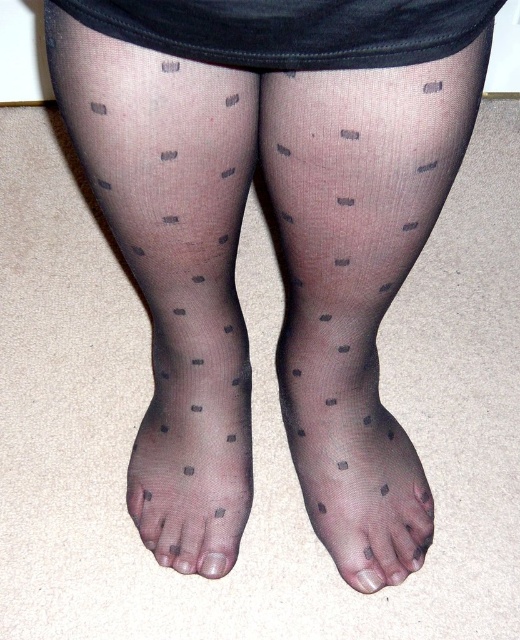
Is transparent sheer tights at center thinner than transparent sheer tights at lower left?

In fact, transparent sheer tights at center might be wider than transparent sheer tights at lower left.

Does transparent sheer tights at center appear under transparent sheer tights at lower left?

Correct, transparent sheer tights at center is located below transparent sheer tights at lower left.

You are a GUI agent. You are given a task and a screenshot of the screen. Output one action in this format:
    pyautogui.click(x=<x>, y=<y>)
    Task: Click on the transparent sheer tights at center
    The image size is (520, 640).
    Given the screenshot: What is the action you would take?
    pyautogui.click(x=358, y=282)

Is point (250, 369) positioned before point (315, 518)?

No, (250, 369) is behind (315, 518).

Is transparent sheer tights at lower left wider than transparent sheer tights at lower center?

Incorrect, transparent sheer tights at lower left's width does not surpass transparent sheer tights at lower center's.

Image resolution: width=520 pixels, height=640 pixels. I want to click on transparent sheer tights at lower left, so click(x=173, y=268).

Which is more to the left, transparent sheer tights at center or transparent nylon toe at center?

transparent sheer tights at center

Can you confirm if transparent sheer tights at center is wider than transparent nylon toe at center?

Yes.

Is point (370, 497) farther from viewer compared to point (380, 573)?

Yes, point (370, 497) is farther from viewer.

You are a GUI agent. You are given a task and a screenshot of the screen. Output one action in this format:
    pyautogui.click(x=<x>, y=<y>)
    Task: Click on the transparent sheer tights at center
    Image resolution: width=520 pixels, height=640 pixels.
    Given the screenshot: What is the action you would take?
    pyautogui.click(x=358, y=282)